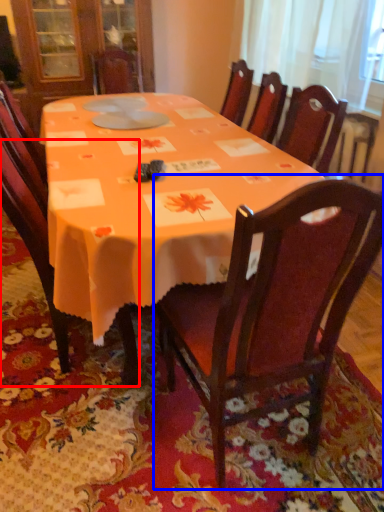
Question: Which of the following is the farthest to the observer, chair (highlighted by a red box) or chair (highlighted by a blue box)?

Choices:
 (A) chair
 (B) chair

Answer: (A)